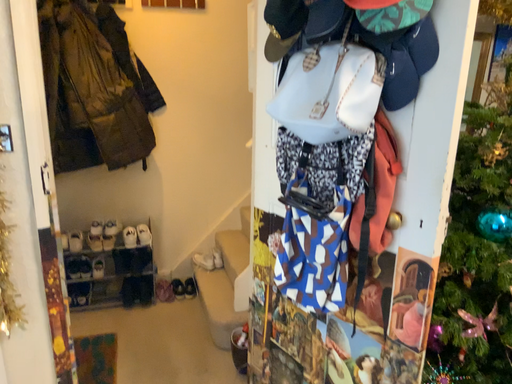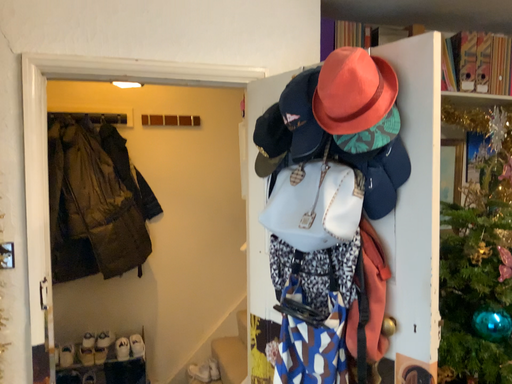
Question: How did the camera likely rotate when shooting the video?

Choices:
 (A) rotated downward
 (B) rotated upward

Answer: (B)